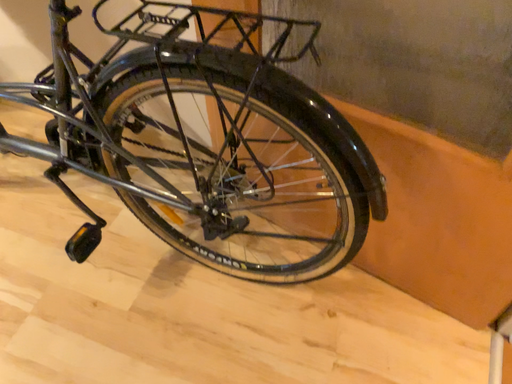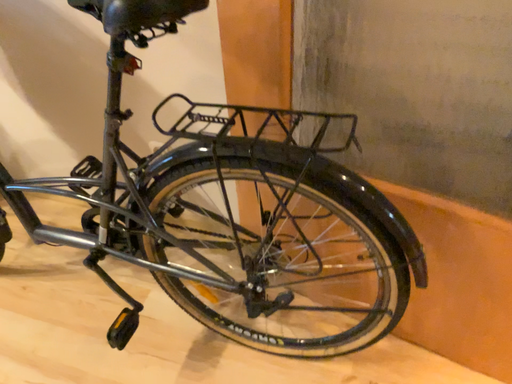
Question: How did the camera likely rotate when shooting the video?

Choices:
 (A) rotated upward
 (B) rotated downward

Answer: (A)